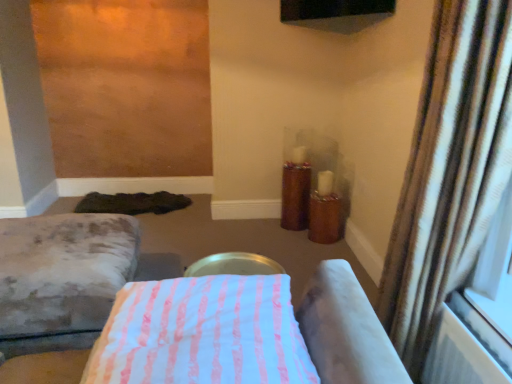
From the picture: Measure the distance between pink striped fabric at center, the 1th furniture viewed from the front, and camera.

The depth of pink striped fabric at center, the 1th furniture viewed from the front, is 31.29 inches.

The image size is (512, 384). Describe the element at coordinates (449, 171) in the screenshot. I see `brown striped curtain at right` at that location.

What do you see at coordinates (62, 278) in the screenshot?
I see `velvet gray ottoman at lower left, acting as the second furniture starting from the right` at bounding box center [62, 278].

Identify the location of wooden candle holder at center-right. (295, 196).

Can you see velvet gray ottoman at lower left, acting as the second furniture starting from the right, touching wooden candle holder at center-right?

velvet gray ottoman at lower left, acting as the second furniture starting from the right, is not next to wooden candle holder at center-right, and they're not touching.

Is wooden candle holder at center-right inside velvet gray ottoman at lower left, which is the first furniture from left to right?

That's incorrect, wooden candle holder at center-right is not inside velvet gray ottoman at lower left, which is the first furniture from left to right.

Is velvet gray ottoman at lower left, acting as the first furniture starting from the back, at the right side of wooden candle holder at center-right?

No.

From the image's perspective, between velvet gray ottoman at lower left, acting as the second furniture starting from the right, and wooden candle holder at center-right, who is located below?

velvet gray ottoman at lower left, acting as the second furniture starting from the right, appears lower in the image.

Considering the positions of objects wooden candle holder at center-right and brown striped curtain at right in the image provided, who is behind, wooden candle holder at center-right or brown striped curtain at right?

wooden candle holder at center-right is further from the camera.

Is wooden candle holder at center-right oriented towards brown striped curtain at right?

Yes, wooden candle holder at center-right is oriented towards brown striped curtain at right.

From the picture: Between wooden candle holder at center-right and brown striped curtain at right, which one has more height?

Standing taller between the two is brown striped curtain at right.

How far apart are wooden candle holder at center-right and brown striped curtain at right?

The distance of wooden candle holder at center-right from brown striped curtain at right is 1.58 meters.

From the image's perspective, does pink striped fabric at center, the 1th furniture viewed from the front, appear higher than velvet gray ottoman at lower left, acting as the second furniture starting from the right?

Indeed, from the image's perspective, pink striped fabric at center, the 1th furniture viewed from the front, is shown above velvet gray ottoman at lower left, acting as the second furniture starting from the right.

Would you say pink striped fabric at center, which is the first furniture from right to left, contains velvet gray ottoman at lower left, which is the first furniture from left to right?

No, velvet gray ottoman at lower left, which is the first furniture from left to right, is located outside of pink striped fabric at center, which is the first furniture from right to left.

Who is more distant, pink striped fabric at center, the 1th furniture viewed from the front, or velvet gray ottoman at lower left, marked as the second furniture in a front-to-back arrangement?

velvet gray ottoman at lower left, marked as the second furniture in a front-to-back arrangement, is further from the camera.

Considering the points (181, 290) and (23, 274), which point is behind, point (181, 290) or point (23, 274)?

Positioned behind is point (23, 274).

From the image's perspective, is wooden candle holder at center-right beneath pink striped fabric at center, which is the first furniture from right to left?

No, from the image's perspective, wooden candle holder at center-right is not below pink striped fabric at center, which is the first furniture from right to left.

Which object is further away from the camera, wooden candle holder at center-right or pink striped fabric at center, the 2th furniture when ordered from back to front?

wooden candle holder at center-right is behind.

Looking at this image, would you say pink striped fabric at center, the 2th furniture when ordered from back to front, is part of wooden candle holder at center-right's contents?

No.

Is wooden candle holder at center-right oriented towards pink striped fabric at center, the 2th furniture when ordered from back to front?

Yes, wooden candle holder at center-right is turned towards pink striped fabric at center, the 2th furniture when ordered from back to front.

Considering the sizes of objects velvet gray ottoman at lower left, which is the first furniture from left to right, and pink striped fabric at center, the 2th furniture when ordered from back to front, in the image provided, who is thinner, velvet gray ottoman at lower left, which is the first furniture from left to right, or pink striped fabric at center, the 2th furniture when ordered from back to front,?

pink striped fabric at center, the 2th furniture when ordered from back to front.

Can you confirm if velvet gray ottoman at lower left, which is the first furniture from left to right, is shorter than pink striped fabric at center, which is the first furniture from right to left?

No.

How different are the orientations of velvet gray ottoman at lower left, acting as the first furniture starting from the back, and pink striped fabric at center, the 1th furniture viewed from the front, in degrees?

The facing directions of velvet gray ottoman at lower left, acting as the first furniture starting from the back, and pink striped fabric at center, the 1th furniture viewed from the front, are 85.8 degrees apart.

From the image's perspective, which is below, velvet gray ottoman at lower left, marked as the second furniture in a front-to-back arrangement, or pink striped fabric at center, the 2th furniture when ordered from back to front?

velvet gray ottoman at lower left, marked as the second furniture in a front-to-back arrangement.

Is pink striped fabric at center, which is the first furniture from right to left, completely or partially outside of wooden candle holder at center-right?

That's correct, pink striped fabric at center, which is the first furniture from right to left, is outside of wooden candle holder at center-right.

From a real-world perspective, is pink striped fabric at center, the 2th furniture when ordered from back to front, over wooden candle holder at center-right?

Yes, from a real-world perspective, pink striped fabric at center, the 2th furniture when ordered from back to front, is above wooden candle holder at center-right.

Where is `furniture that appears above the wooden candle holder at center-right (from a real-world perspective)`? Image resolution: width=512 pixels, height=384 pixels. furniture that appears above the wooden candle holder at center-right (from a real-world perspective) is located at coordinates (239, 333).

Considering the positions of objects pink striped fabric at center, the second furniture when ordered from left to right, and wooden candle holder at center-right in the image provided, who is behind, pink striped fabric at center, the second furniture when ordered from left to right, or wooden candle holder at center-right?

wooden candle holder at center-right is further away from the camera.

How far apart are brown striped curtain at right and pink striped fabric at center, which is the first furniture from right to left?

A distance of 61.10 centimeters exists between brown striped curtain at right and pink striped fabric at center, which is the first furniture from right to left.

Is brown striped curtain at right to the left of pink striped fabric at center, which is the first furniture from right to left, from the viewer's perspective?

No.

Is brown striped curtain at right in front of or behind pink striped fabric at center, which is the first furniture from right to left, in the image?

brown striped curtain at right is behind pink striped fabric at center, which is the first furniture from right to left.

There is a pink striped fabric at center, the second furniture when ordered from left to right. What are the coordinates of `curtain above it (from a real-world perspective)` in the screenshot? It's located at (449, 171).

At what (x,y) coordinates should I click in order to perform the action: click on furniture below the wooden candle holder at center-right (from a real-world perspective). Please return your answer as a coordinate pair (x, y). Image resolution: width=512 pixels, height=384 pixels. Looking at the image, I should click on (62, 278).

Image resolution: width=512 pixels, height=384 pixels. I want to click on curtain in front of the wooden candle holder at center-right, so click(x=449, y=171).

Estimate the real-world distances between objects in this image. Which object is further from brown striped curtain at right, pink striped fabric at center, the 1th furniture viewed from the front, or wooden candle holder at center-right?

wooden candle holder at center-right lies further to brown striped curtain at right than the other object.

From the picture: When comparing their distances from brown striped curtain at right, does wooden candle holder at center-right or velvet gray ottoman at lower left, which is the first furniture from left to right, seem closer?

The object closer to brown striped curtain at right is velvet gray ottoman at lower left, which is the first furniture from left to right.

When comparing their distances from wooden candle holder at center-right, does brown striped curtain at right or pink striped fabric at center, which is the first furniture from right to left, seem closer?

Among the two, brown striped curtain at right is located nearer to wooden candle holder at center-right.

Based on their spatial positions, is pink striped fabric at center, which is the first furniture from right to left, or brown striped curtain at right further from wooden candle holder at center-right?

Among the two, pink striped fabric at center, which is the first furniture from right to left, is located further to wooden candle holder at center-right.

Which object lies further to the anchor point brown striped curtain at right, velvet gray ottoman at lower left, acting as the first furniture starting from the back, or wooden candle holder at center-right?

wooden candle holder at center-right.

Consider the image. When comparing their distances from velvet gray ottoman at lower left, acting as the first furniture starting from the back, does wooden candle holder at center-right or brown striped curtain at right seem closer?

brown striped curtain at right is positioned closer to the anchor velvet gray ottoman at lower left, acting as the first furniture starting from the back.

Considering their positions, is velvet gray ottoman at lower left, marked as the second furniture in a front-to-back arrangement, positioned further to pink striped fabric at center, the second furniture when ordered from left to right, than wooden candle holder at center-right?

The object further to pink striped fabric at center, the second furniture when ordered from left to right, is wooden candle holder at center-right.

Based on their spatial positions, is pink striped fabric at center, the 2th furniture when ordered from back to front, or velvet gray ottoman at lower left, acting as the first furniture starting from the back, closer to brown striped curtain at right?

Based on the image, pink striped fabric at center, the 2th furniture when ordered from back to front, appears to be nearer to brown striped curtain at right.

I want to click on curtain located between pink striped fabric at center, which is the first furniture from right to left, and wooden candle holder at center-right in the depth direction, so click(449, 171).

Identify the location of furniture between velvet gray ottoman at lower left, which is the first furniture from left to right, and brown striped curtain at right. (239, 333).

Locate an element on the screen. Image resolution: width=512 pixels, height=384 pixels. furniture located between pink striped fabric at center, the 2th furniture when ordered from back to front, and wooden candle holder at center-right in the depth direction is located at coordinates (62, 278).

The height and width of the screenshot is (384, 512). Find the location of `furniture between brown striped curtain at right and wooden candle holder at center-right along the z-axis`. furniture between brown striped curtain at right and wooden candle holder at center-right along the z-axis is located at coordinates (62, 278).